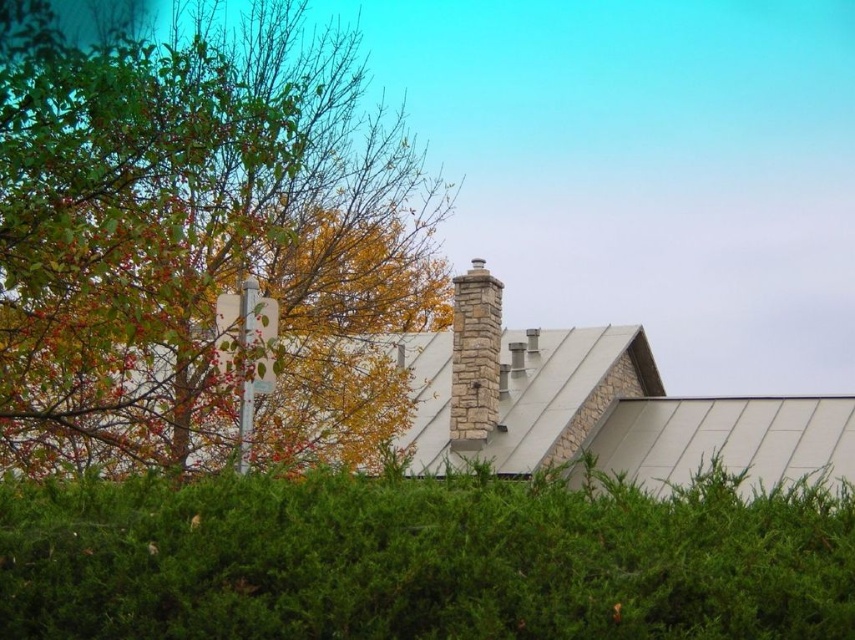
I want to click on green leafy tree at upper left, so point(205,244).

Is the position of green leafy tree at upper left less distant than that of green leafy hedge at center?

No, green leafy tree at upper left is behind green leafy hedge at center.

Image resolution: width=855 pixels, height=640 pixels. I want to click on green leafy tree at upper left, so click(205, 244).

Can you confirm if green leafy tree at upper left is positioned below stone chimney at center?

No, green leafy tree at upper left is not below stone chimney at center.

Can you confirm if green leafy tree at upper left is thinner than stone chimney at center?

In fact, green leafy tree at upper left might be wider than stone chimney at center.

This screenshot has height=640, width=855. Identify the location of green leafy tree at upper left. (205, 244).

This screenshot has height=640, width=855. I want to click on green leafy tree at upper left, so click(x=205, y=244).

Is green leafy hedge at center taller than stone chimney at center?

No, green leafy hedge at center is not taller than stone chimney at center.

This screenshot has height=640, width=855. Describe the element at coordinates (423, 560) in the screenshot. I see `green leafy hedge at center` at that location.

Find the location of a particular element. green leafy hedge at center is located at coordinates (423, 560).